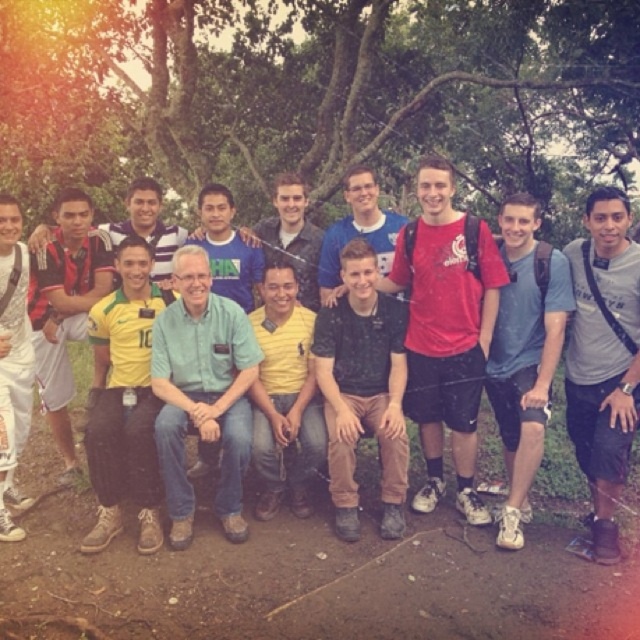
Question: Can you confirm if gray cotton t-shirt at center is smaller than white matte pants at left?

Choices:
 (A) yes
 (B) no

Answer: (B)

Question: Estimate the real-world distances between objects in this image. Which object is farther from the blue t-shirt at center?

Choices:
 (A) yellow jersey at left
 (B) matte blue shirt at center
 (C) yellow matte shirt at center

Answer: (A)

Question: Which of the following is the closest to the observer?

Choices:
 (A) yellow matte shirt at center
 (B) blue t-shirt at center
 (C) matte black shirt at center

Answer: (A)

Question: Based on their relative distances, which object is farther from the white matte pants at left?

Choices:
 (A) gray cotton t-shirt at center
 (B) light blue shirt at center
 (C) dark brown leather pants at center

Answer: (A)

Question: Does matte red t-shirt at center have a greater width compared to dark brown leather pants at center?

Choices:
 (A) yes
 (B) no

Answer: (A)

Question: Is dark brown leather pants at center above yellow matte shirt at center?

Choices:
 (A) yes
 (B) no

Answer: (A)